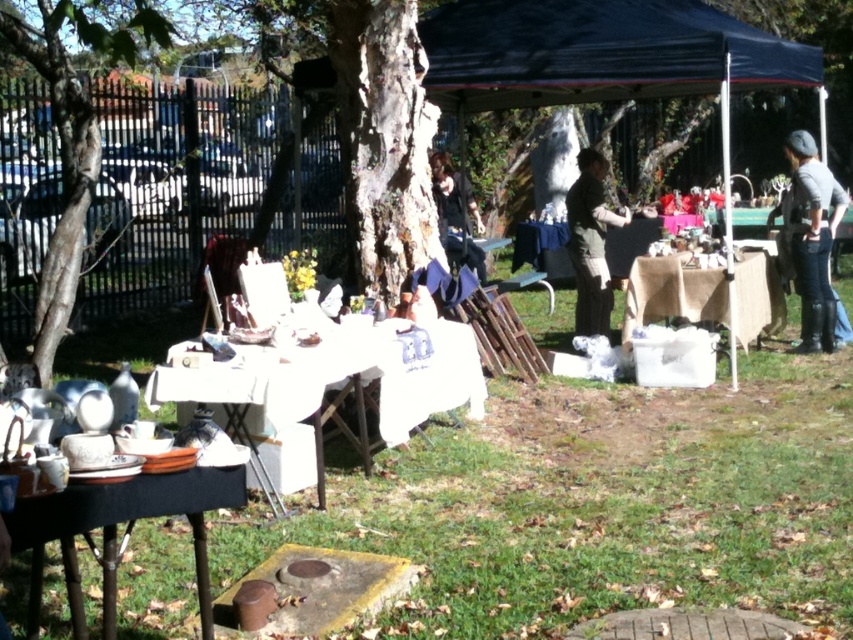
Question: Which of the following is the farthest from the observer?

Choices:
 (A) (643, 13)
 (B) (799, 282)
 (C) (154, 33)
 (D) (672, 262)

Answer: (B)

Question: Is white fabric picnic table at center wider than dark brown leather jacket at center?

Choices:
 (A) yes
 (B) no

Answer: (A)

Question: Among these objects, which one is farthest from the camera?

Choices:
 (A) blue fabric tent at upper center
 (B) burlap table at center
 (C) dark brown leather jacket at center

Answer: (C)

Question: In this image, where is black fabric table at lower left located relative to dark brown leather jacket at center?

Choices:
 (A) below
 (B) above

Answer: (A)

Question: Is gray denim jeans at right wider than black fabric jacket at center?

Choices:
 (A) yes
 (B) no

Answer: (B)

Question: Which point appears farthest from the camera in this image?

Choices:
 (A) (735, 294)
 (B) (216, 486)

Answer: (A)